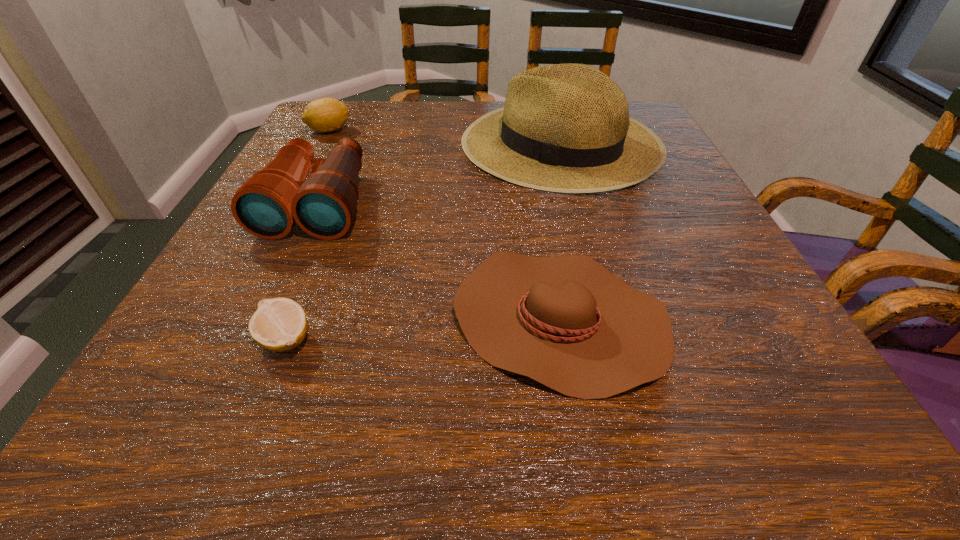
At what (x,y) coordinates should I click in order to perform the action: click on unoccupied position between the fourth shortest object and the tallest object. Please return your answer as a coordinate pair (x, y). Image resolution: width=960 pixels, height=540 pixels. Looking at the image, I should click on (439, 174).

At what (x,y) coordinates should I click in order to perform the action: click on vacant region between the right lemon and the cowboy hat. Please return your answer as a coordinate pair (x, y). Looking at the image, I should click on (422, 328).

Locate an element on the screen. The width and height of the screenshot is (960, 540). free space between the binoculars and the cowboy hat is located at coordinates (438, 261).

Where is `empty space that is in between the cowboy hat and the tallest object`? empty space that is in between the cowboy hat and the tallest object is located at coordinates (560, 231).

Find the location of a particular element. vacant space that is in between the binoculars and the shortest object is located at coordinates (301, 271).

Locate an element on the screen. The height and width of the screenshot is (540, 960). vacant space that is in between the sunhat and the cowboy hat is located at coordinates (560, 231).

You are a GUI agent. You are given a task and a screenshot of the screen. Output one action in this format:
    pyautogui.click(x=<x>, y=<y>)
    Task: Click on the object that stands as the third closest to the left lemon
    
    Given the screenshot: What is the action you would take?
    pyautogui.click(x=567, y=322)

Find the location of a particular element. The height and width of the screenshot is (540, 960). object that is the fourth closest to the tallest object is located at coordinates (279, 324).

The width and height of the screenshot is (960, 540). In order to click on vacant space that satisfies the following two spatial constraints: 1. on the back side of the sunhat; 2. on the right side of the shortest object in this screenshot , I will do `click(363, 144)`.

Find the location of a particular element. Image resolution: width=960 pixels, height=540 pixels. free location that satisfies the following two spatial constraints: 1. through the lenses of the shortest object; 2. on the right side of the binoculars is located at coordinates (255, 339).